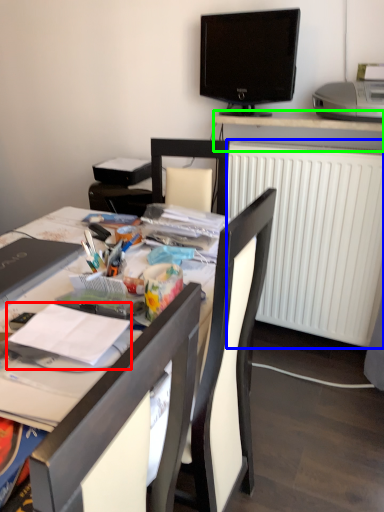
Question: Which object is the farthest from magazine (highlighted by a red box)? Choose among these: radiator (highlighted by a blue box) or desk (highlighted by a green box).

Choices:
 (A) radiator
 (B) desk

Answer: (B)